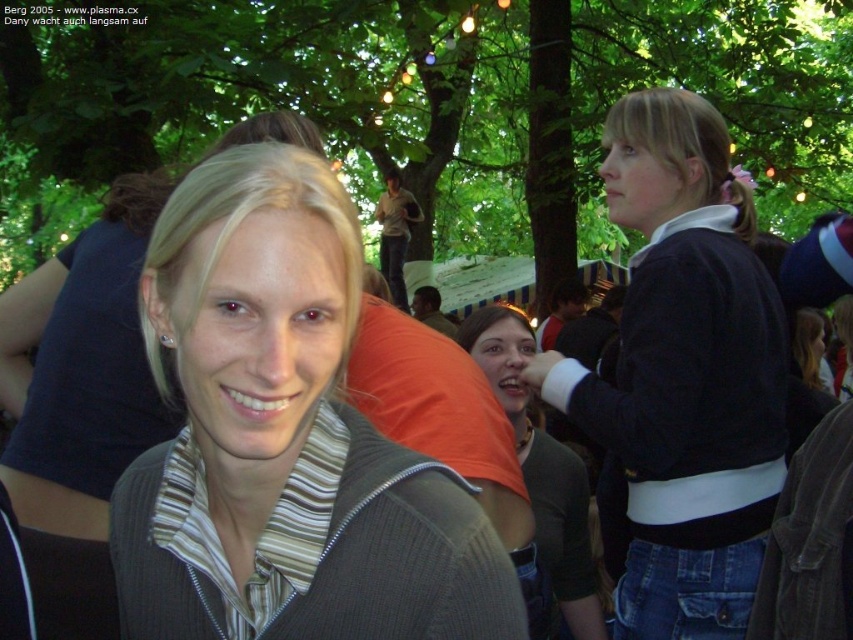
Between matte gray sweater at center and dark blue sweater at right, which one appears on the right side from the viewer's perspective?

From the viewer's perspective, dark blue sweater at right appears more on the right side.

Which of these two, matte gray sweater at center or dark blue sweater at right, stands taller?

dark blue sweater at right

The image size is (853, 640). What do you see at coordinates (283, 438) in the screenshot?
I see `matte gray sweater at center` at bounding box center [283, 438].

The width and height of the screenshot is (853, 640). In order to click on matte gray sweater at center in this screenshot , I will do `click(283, 438)`.

In the scene shown: Is matte gray sweater at center positioned at the back of matte black sweater at center?

No, it is in front of matte black sweater at center.

Between matte gray sweater at center and matte black sweater at center, which one has more height?

matte black sweater at center is taller.

Locate an element on the screen. The image size is (853, 640). matte gray sweater at center is located at coordinates (283, 438).

Who is shorter, dark blue sweater at right or matte black sweater at center?

Standing shorter between the two is matte black sweater at center.

Describe the element at coordinates (683, 374) in the screenshot. I see `dark blue sweater at right` at that location.

Where is `dark blue sweater at right`? Image resolution: width=853 pixels, height=640 pixels. dark blue sweater at right is located at coordinates (683, 374).